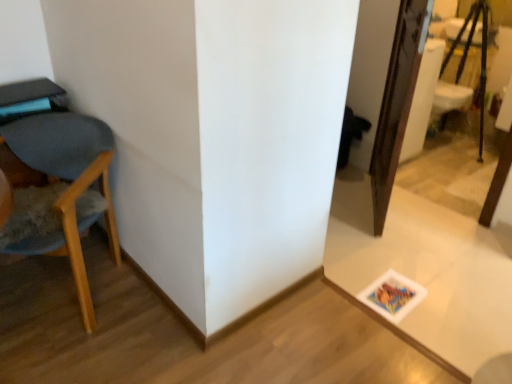
Question: Should I look upward or downward to see wooden chair at left?

Choices:
 (A) down
 (B) up

Answer: (A)

Question: Is wooden chair at left positioned beyond the bounds of white glossy table at lower right?

Choices:
 (A) no
 (B) yes

Answer: (B)

Question: Are wooden chair at left and white glossy table at lower right far apart?

Choices:
 (A) no
 (B) yes

Answer: (B)

Question: From a real-world perspective, is wooden chair at left positioned under white glossy table at lower right based on gravity?

Choices:
 (A) no
 (B) yes

Answer: (A)

Question: Can you confirm if wooden chair at left is thinner than white glossy table at lower right?

Choices:
 (A) yes
 (B) no

Answer: (A)

Question: Is wooden chair at left surrounding white glossy table at lower right?

Choices:
 (A) yes
 (B) no

Answer: (B)

Question: Can you confirm if wooden chair at left is smaller than white glossy table at lower right?

Choices:
 (A) no
 (B) yes

Answer: (A)

Question: Does white glossy table at lower right have a greater width compared to wooden tripod at upper right?

Choices:
 (A) yes
 (B) no

Answer: (A)

Question: Could you tell me if white glossy table at lower right is turned towards wooden tripod at upper right?

Choices:
 (A) yes
 (B) no

Answer: (B)

Question: From a real-world perspective, is white glossy table at lower right on wooden tripod at upper right?

Choices:
 (A) yes
 (B) no

Answer: (B)

Question: Can you confirm if white glossy table at lower right is smaller than wooden tripod at upper right?

Choices:
 (A) yes
 (B) no

Answer: (A)

Question: Is the depth of white glossy table at lower right less than that of wooden tripod at upper right?

Choices:
 (A) no
 (B) yes

Answer: (B)

Question: Considering the relative positions of white glossy table at lower right and wooden tripod at upper right in the image provided, is white glossy table at lower right to the left of wooden tripod at upper right from the viewer's perspective?

Choices:
 (A) no
 (B) yes

Answer: (B)

Question: Is white glossy table at lower right thinner than wooden chair at left?

Choices:
 (A) yes
 (B) no

Answer: (B)